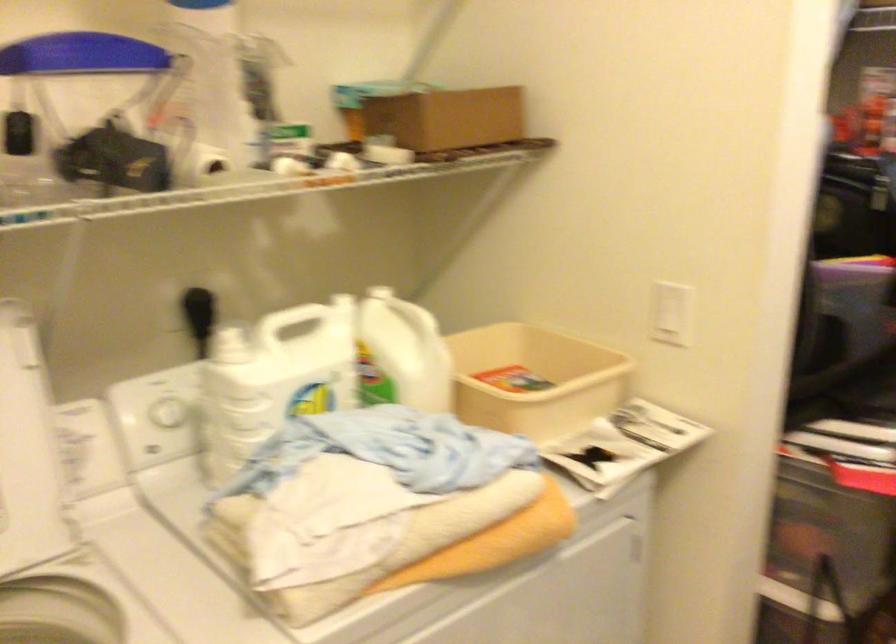
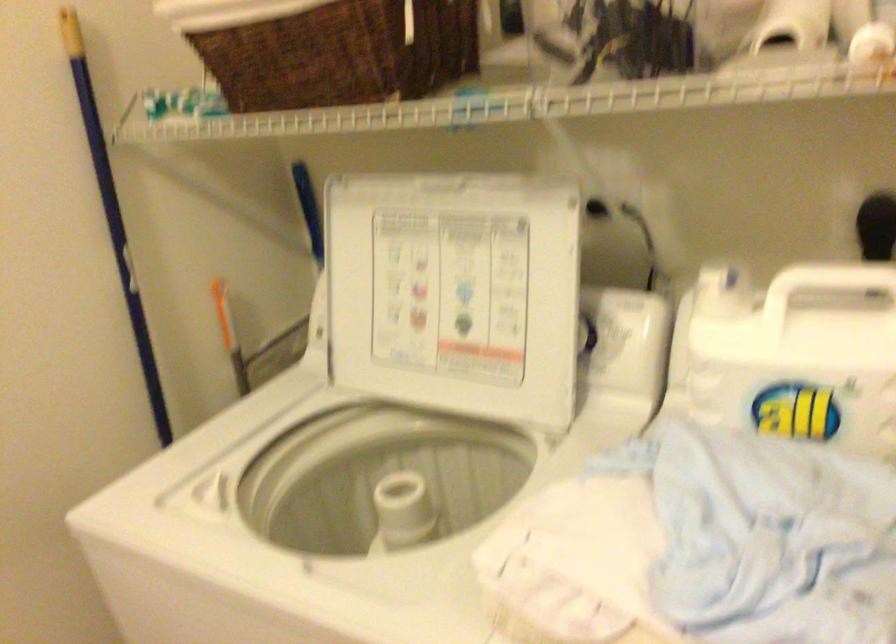
Locate, in the second image, the point that corresponds to point (73, 430) in the first image.

(616, 325)